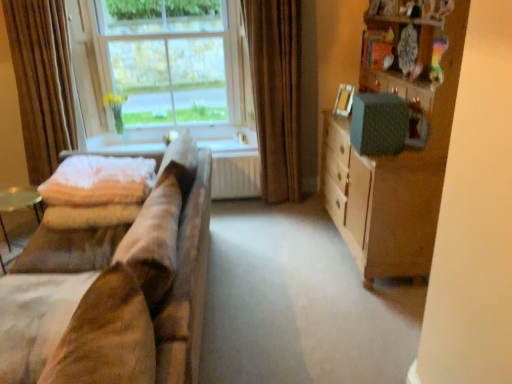
Find the location of a particular element. vacant space positioned to the left of wooden cabinet at right is located at coordinates (280, 250).